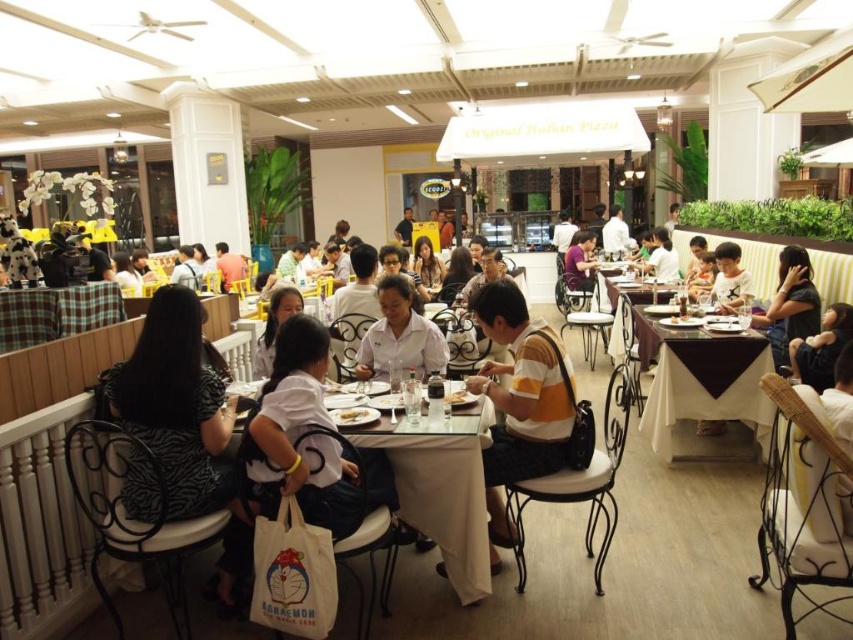
Question: Based on their relative distances, which object is farther from the white matte shirt at center?

Choices:
 (A) matte black shirt at right
 (B) zebra print dress at left
 (C) yellow-orange striped shirt at center
 (D) white fabric table at center

Answer: (A)

Question: Does white marble table at center lie behind white matte shirt at center?

Choices:
 (A) no
 (B) yes

Answer: (B)

Question: Is zebra print dress at left further to the viewer compared to yellow-orange striped shirt at center?

Choices:
 (A) yes
 (B) no

Answer: (B)

Question: Which object is farther from the camera taking this photo?

Choices:
 (A) zebra print dress at left
 (B) matte black shirt at right

Answer: (B)

Question: Can you confirm if zebra print dress at left is thinner than white fabric table at center?

Choices:
 (A) yes
 (B) no

Answer: (B)

Question: Which point is farther to the camera?

Choices:
 (A) click(x=372, y=340)
 (B) click(x=430, y=499)
 (C) click(x=572, y=252)

Answer: (C)